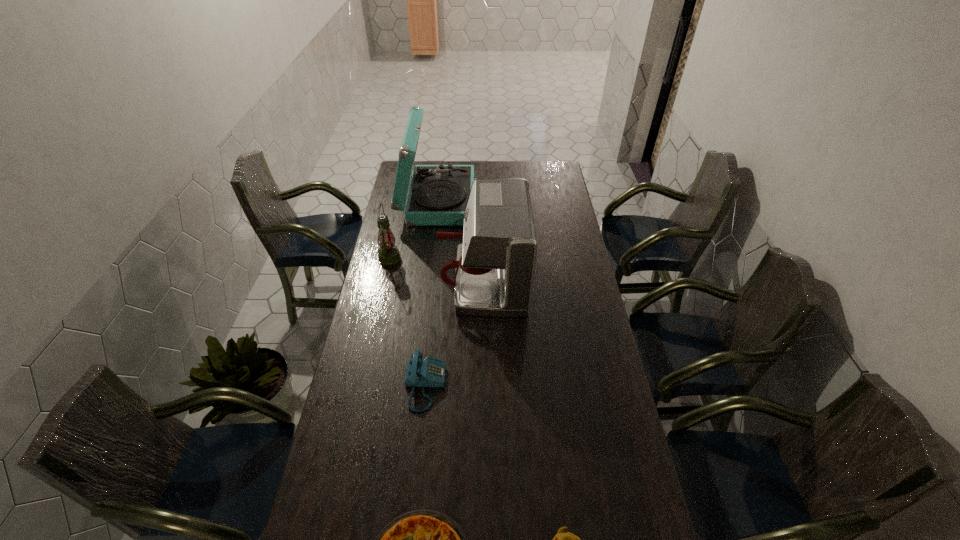
What are the coordinates of `vacant space in between the fourth tallest object and the farthest object` in the screenshot? It's located at click(432, 293).

Find the location of `vacant space that's between the fourth shortest object and the coffee maker`. vacant space that's between the fourth shortest object and the coffee maker is located at coordinates pyautogui.click(x=436, y=269).

Choose which object is the fourth nearest neighbor to the third tallest object. Please provide its 2D coordinates. Your answer should be formatted as a tuple, i.e. [(x, y)], where the tuple contains the x and y coordinates of a point satisfying the conditions above.

[(425, 539)]

You are a GUI agent. You are given a task and a screenshot of the screen. Output one action in this format:
    pyautogui.click(x=<x>, y=<y>)
    Task: Click on the object that is the third closest to the record player
    
    Given the screenshot: What is the action you would take?
    (431, 372)